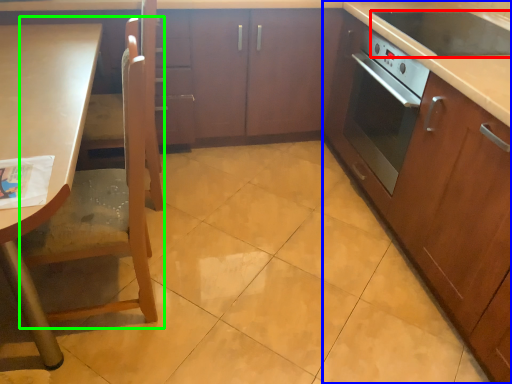
Question: Which object is the closest to the kitchen appliance (highlighted by a red box)? Choose among these: cabinetry (highlighted by a blue box) or chair (highlighted by a green box).

Choices:
 (A) cabinetry
 (B) chair

Answer: (A)